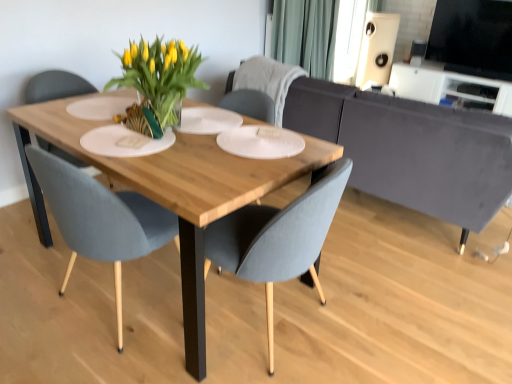
Question: Looking at the image, does green fabric curtain at upper center seem bigger or smaller compared to gray fabric chair at center, the 3th chair in the front-to-back sequence?

Choices:
 (A) small
 (B) big

Answer: (B)

Question: Is green fabric curtain at upper center wider or thinner than gray fabric chair at center, the 3th chair in the front-to-back sequence?

Choices:
 (A) thin
 (B) wide

Answer: (A)

Question: Estimate the real-world distances between objects in this image. Which object is farther from the gray fabric chair at center, marked as the first chair in a back-to-front arrangement?

Choices:
 (A) green fabric curtain at upper center
 (B) matte gray chair at center, marked as the 2th chair in a back-to-front arrangement
 (C) white matte speaker at upper right
 (D) natural wood table at center
 (E) matte gray chair at center, the 3th chair when ordered from back to front

Answer: (C)

Question: Which is nearer to the gray fabric chair at center, marked as the first chair in a back-to-front arrangement?

Choices:
 (A) natural wood table at center
 (B) white plastic entertainment center at upper right
 (C) matte gray chair at center, which is the 2th chair from front to back
 (D) green fabric curtain at upper center
 (E) black glossy tv at upper right, which is the first window screen from front to back

Answer: (A)